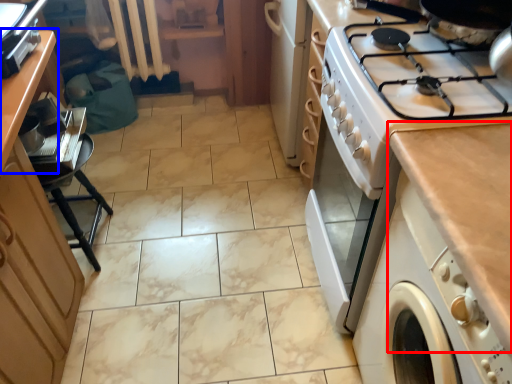
Question: Which point is further to the camera, countertop (highlighted by a red box) or counter (highlighted by a blue box)?

Choices:
 (A) countertop
 (B) counter

Answer: (B)